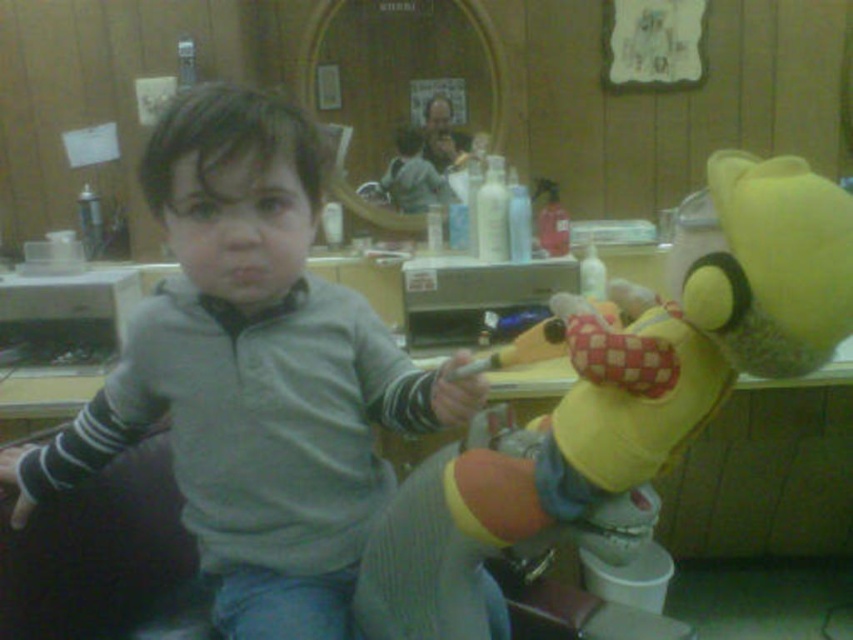
Question: Observing the image, what is the correct spatial positioning of yellow plush toy at center in reference to smooth plastic comb at upper center?

Choices:
 (A) above
 (B) below

Answer: (B)

Question: Does yellow plush toy at center have a larger size compared to smooth plastic comb at upper center?

Choices:
 (A) yes
 (B) no

Answer: (A)

Question: Which object is closer to the camera taking this photo?

Choices:
 (A) smooth plastic comb at upper center
 (B) yellow plush toy at center

Answer: (B)

Question: Does yellow plush toy at center appear on the right side of smooth plastic comb at upper center?

Choices:
 (A) yes
 (B) no

Answer: (A)

Question: Among these points, which one is nearest to the camera?

Choices:
 (A) (444, 154)
 (B) (386, 528)

Answer: (B)